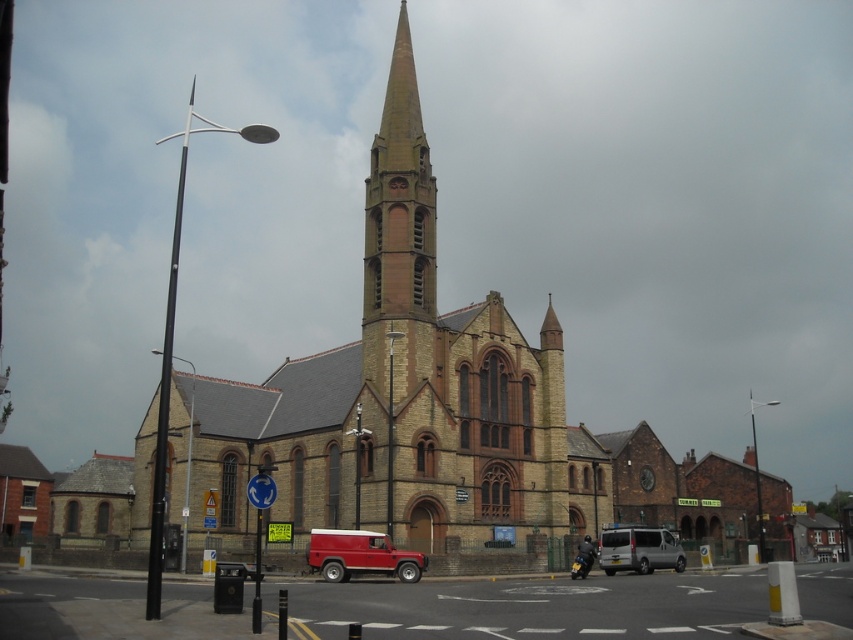
Is point (403, 291) behind point (360, 540)?

Yes, point (403, 291) is farther from viewer.

Is point (364, 189) positioned before point (341, 566)?

That is False.

You are a GUI agent. You are given a task and a screenshot of the screen. Output one action in this format:
    pyautogui.click(x=<x>, y=<y>)
    Task: Click on the brown brick tower at center
    The width and height of the screenshot is (853, 640).
    Given the screenshot: What is the action you would take?
    pyautogui.click(x=399, y=234)

Does brick church at center appear on the right side of matte red van at center?

Correct, you'll find brick church at center to the right of matte red van at center.

Is brick church at center above matte red van at center?

Yes.

The width and height of the screenshot is (853, 640). Identify the location of brick church at center. (407, 394).

Find the location of a particular element. The height and width of the screenshot is (640, 853). matte red van at center is located at coordinates (360, 556).

Identify the location of matte red van at center. (360, 556).

In order to click on matte red van at center in this screenshot , I will do (x=360, y=556).